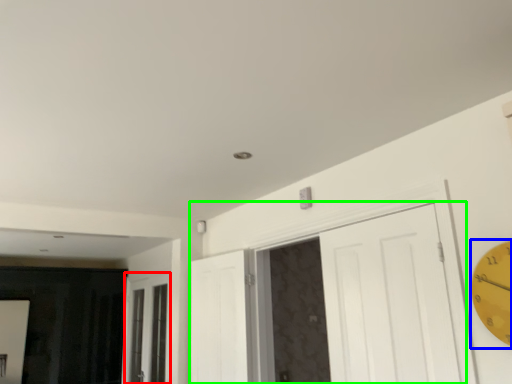
Question: Which object is positioned farthest from window (highlighted by a red box)? Select from clock (highlighted by a blue box) and door (highlighted by a green box).

Choices:
 (A) clock
 (B) door

Answer: (A)